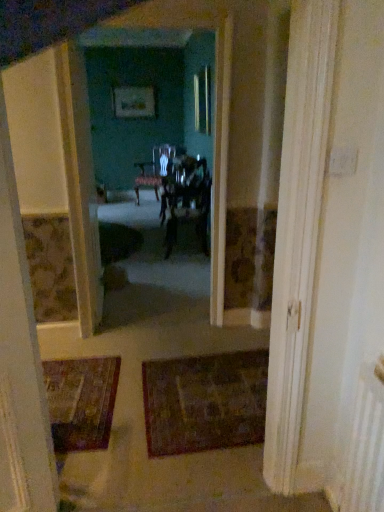
The height and width of the screenshot is (512, 384). I want to click on vacant space situated above dark brown textured rug at center (from a real-world perspective), so click(x=219, y=386).